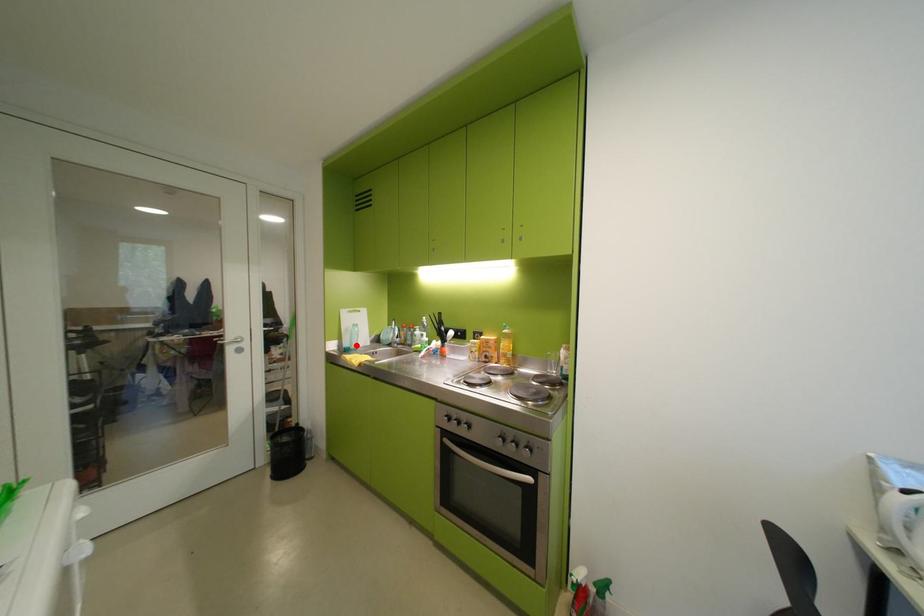
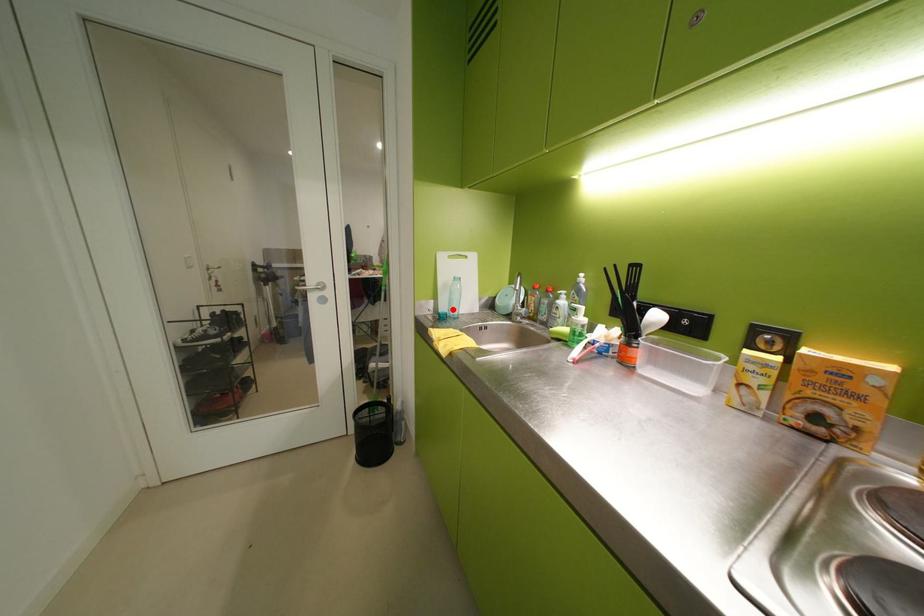
I am providing you with two images of the same scene from different viewpoints. A red point is marked on the first image and another point is marked on the second image. Do the highlighted points in image1 and image2 indicate the same real-world spot?

Yes